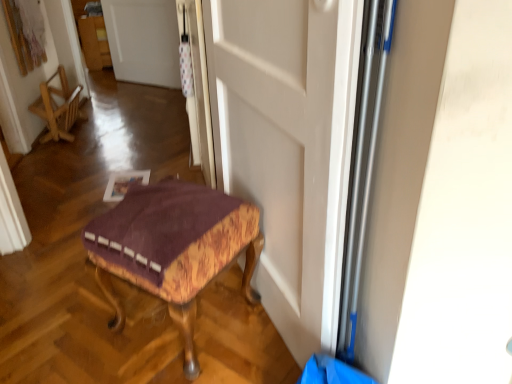
Where is `vacant space underneath velvet purple cushioned stool at lower center (from a real-world perspective)`? The width and height of the screenshot is (512, 384). vacant space underneath velvet purple cushioned stool at lower center (from a real-world perspective) is located at coordinates (199, 319).